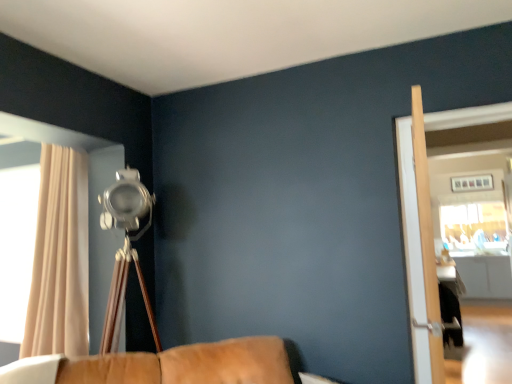
Question: Is clear glass screen door at right, arranged as the 1th screen door when viewed from the right, wider than brown leather couch at lower center?

Choices:
 (A) no
 (B) yes

Answer: (A)

Question: Is clear glass screen door at right, arranged as the 1th screen door when viewed from the right, smaller than brown leather couch at lower center?

Choices:
 (A) no
 (B) yes

Answer: (B)

Question: Is there a large distance between clear glass screen door at right, arranged as the 1th screen door when viewed from the right, and brown leather couch at lower center?

Choices:
 (A) yes
 (B) no

Answer: (A)

Question: Does clear glass screen door at right, arranged as the 1th screen door when viewed from the right, lie behind brown leather couch at lower center?

Choices:
 (A) no
 (B) yes

Answer: (B)

Question: Can we say clear glass screen door at right, which is counted as the second screen door, starting from the left, lies outside brown leather couch at lower center?

Choices:
 (A) yes
 (B) no

Answer: (A)

Question: Is brown leather couch at lower center at the back of clear glass screen door at right, which is counted as the second screen door, starting from the left?

Choices:
 (A) yes
 (B) no

Answer: (B)

Question: Does brown leather couch at lower center have a lesser height compared to light wood screen door at right, the 1th screen door when ordered from left to right?

Choices:
 (A) yes
 (B) no

Answer: (A)

Question: Is brown leather couch at lower center at the right side of light wood screen door at right, the 1th screen door when ordered from left to right?

Choices:
 (A) yes
 (B) no

Answer: (B)

Question: Is the position of brown leather couch at lower center less distant than that of light wood screen door at right, which is the second screen door from right to left?

Choices:
 (A) yes
 (B) no

Answer: (A)

Question: From the image's perspective, does brown leather couch at lower center appear lower than light wood screen door at right, the 1th screen door when ordered from left to right?

Choices:
 (A) yes
 (B) no

Answer: (A)

Question: Considering the relative sizes of brown leather couch at lower center and light wood screen door at right, the 1th screen door when ordered from left to right, in the image provided, is brown leather couch at lower center smaller than light wood screen door at right, the 1th screen door when ordered from left to right,?

Choices:
 (A) yes
 (B) no

Answer: (B)

Question: Are brown leather couch at lower center and light wood screen door at right, which is the second screen door from right to left, far apart?

Choices:
 (A) yes
 (B) no

Answer: (A)

Question: Considering the relative sizes of brown leather couch at lower center and beige fabric curtain at left in the image provided, is brown leather couch at lower center taller than beige fabric curtain at left?

Choices:
 (A) yes
 (B) no

Answer: (B)